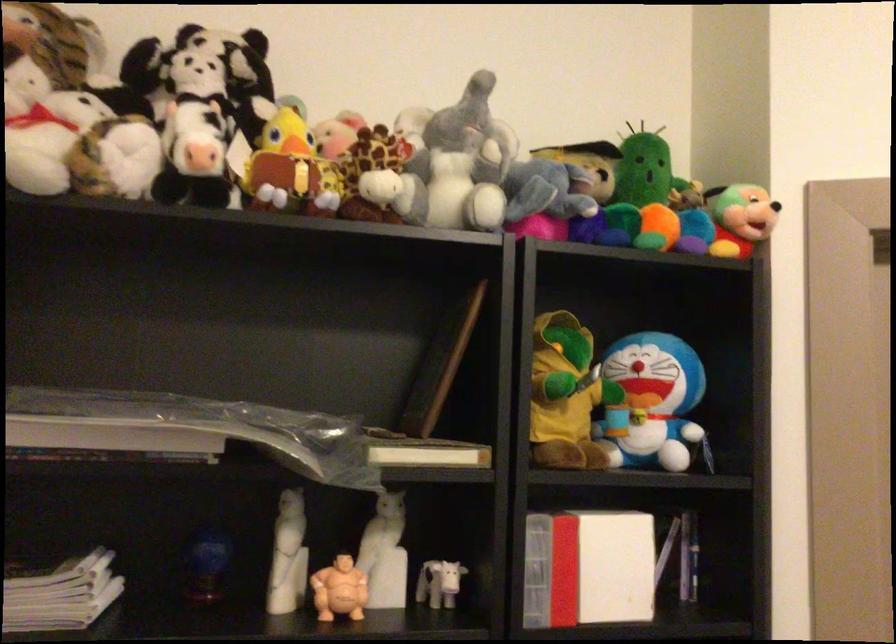
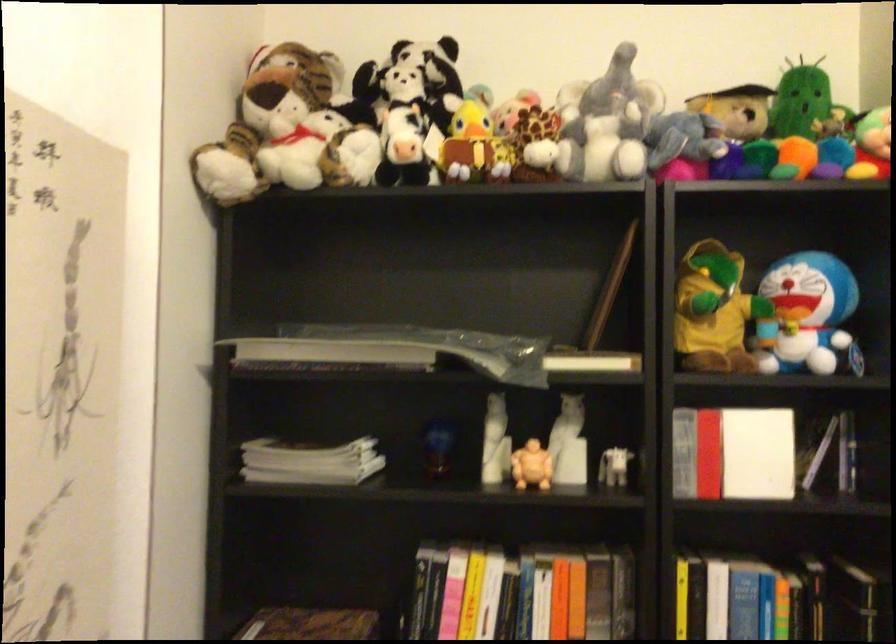
Locate, in the second image, the point that corresponds to point 614,567 in the first image.

(757, 453)